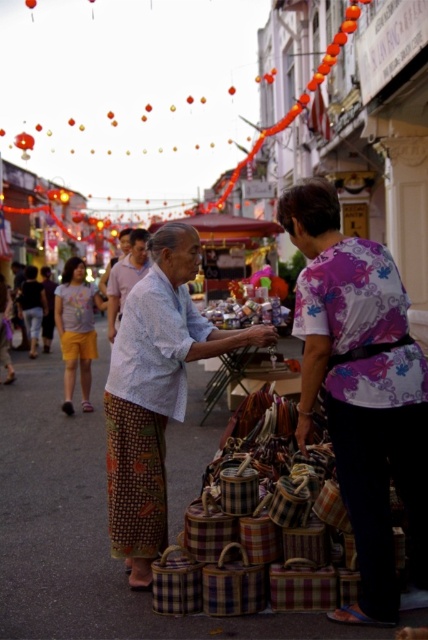
You are a photographer standing at the back of the market and want to take a photo of the light blue woven shirt at center and the yellow cotton shorts at left. However, you notice that one of them is partially hidden. Which one is blocking the view of the other?

The light blue woven shirt at center is behind the yellow cotton shorts at left, so the yellow cotton shorts at left is blocking the view of the light blue woven shirt at center.